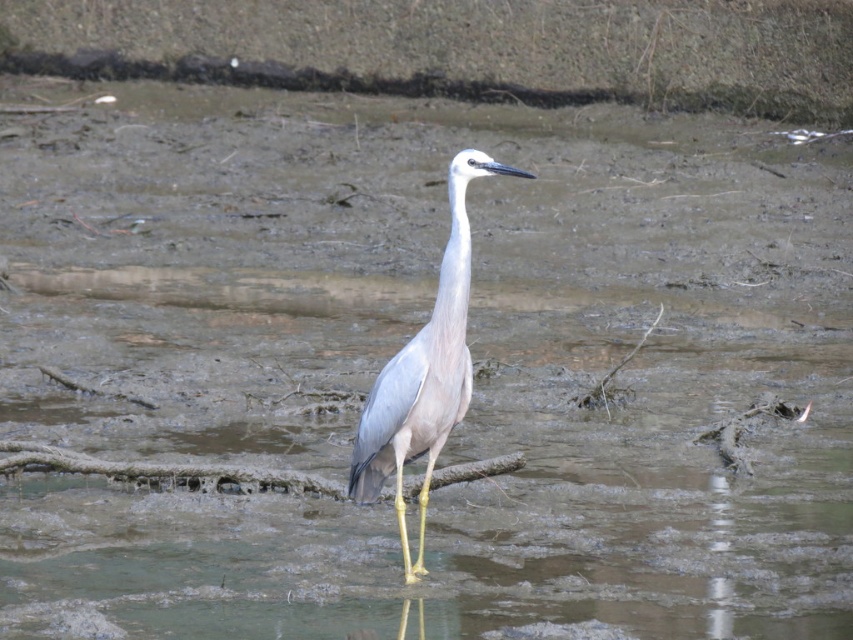
You are a wildlife photographer aiming to capture the white matte bird at center in the image. Based on the coordinates provided, where should you position your camera to ensure the bird is centered in your shot?

The white matte bird at center is located at coordinates point (424, 372), so you should position your camera to aim directly at that point to center the bird in your shot.

You are observing a bird in a wetland. You notice the white matte bird at center and the white smooth neck at center. Which object is positioned lower in the image?

The white matte bird at center is located below the white smooth neck at center, so it is positioned lower in the image.